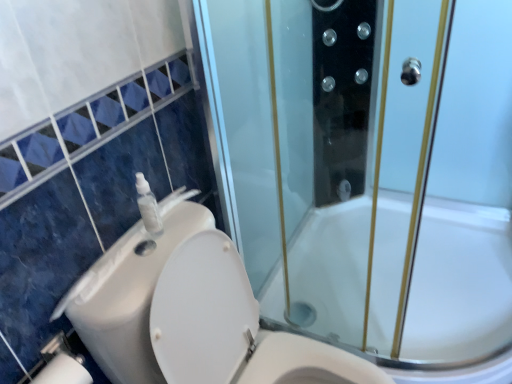
Question: Is transparent glass shower door at center positioned behind transparent plastic soap dispenser at upper left?

Choices:
 (A) no
 (B) yes

Answer: (A)

Question: Would you say transparent glass shower door at center is outside transparent plastic soap dispenser at upper left?

Choices:
 (A) yes
 (B) no

Answer: (A)

Question: Can you confirm if transparent glass shower door at center is wider than transparent plastic soap dispenser at upper left?

Choices:
 (A) yes
 (B) no

Answer: (A)

Question: Does transparent glass shower door at center have a larger size compared to transparent plastic soap dispenser at upper left?

Choices:
 (A) yes
 (B) no

Answer: (A)

Question: Does transparent glass shower door at center have a smaller size compared to transparent plastic soap dispenser at upper left?

Choices:
 (A) no
 (B) yes

Answer: (A)

Question: Which is correct: transparent glass shower door at center is inside transparent plastic soap dispenser at upper left, or outside of it?

Choices:
 (A) inside
 (B) outside

Answer: (B)

Question: In terms of height, does transparent glass shower door at center look taller or shorter compared to transparent plastic soap dispenser at upper left?

Choices:
 (A) tall
 (B) short

Answer: (A)

Question: Is transparent glass shower door at center in front of or behind transparent plastic soap dispenser at upper left in the image?

Choices:
 (A) behind
 (B) front

Answer: (B)

Question: Considering the positions of transparent glass shower door at center and transparent plastic soap dispenser at upper left in the image, is transparent glass shower door at center wider or thinner than transparent plastic soap dispenser at upper left?

Choices:
 (A) thin
 (B) wide

Answer: (B)

Question: In terms of size, does transparent plastic soap dispenser at upper left appear bigger or smaller than white plastic toilet at lower left?

Choices:
 (A) big
 (B) small

Answer: (B)

Question: Is transparent plastic soap dispenser at upper left situated inside white plastic toilet at lower left or outside?

Choices:
 (A) inside
 (B) outside

Answer: (B)

Question: Is transparent plastic soap dispenser at upper left in front of or behind white plastic toilet at lower left in the image?

Choices:
 (A) behind
 (B) front

Answer: (A)

Question: Considering the positions of transparent plastic soap dispenser at upper left and white plastic toilet at lower left in the image, is transparent plastic soap dispenser at upper left wider or thinner than white plastic toilet at lower left?

Choices:
 (A) thin
 (B) wide

Answer: (A)

Question: From the image's perspective, is transparent plastic soap dispenser at upper left located above or below white plastic sink at left?

Choices:
 (A) above
 (B) below

Answer: (A)

Question: Is point (157, 208) positioned closer to the camera than point (144, 258)?

Choices:
 (A) closer
 (B) farther

Answer: (B)